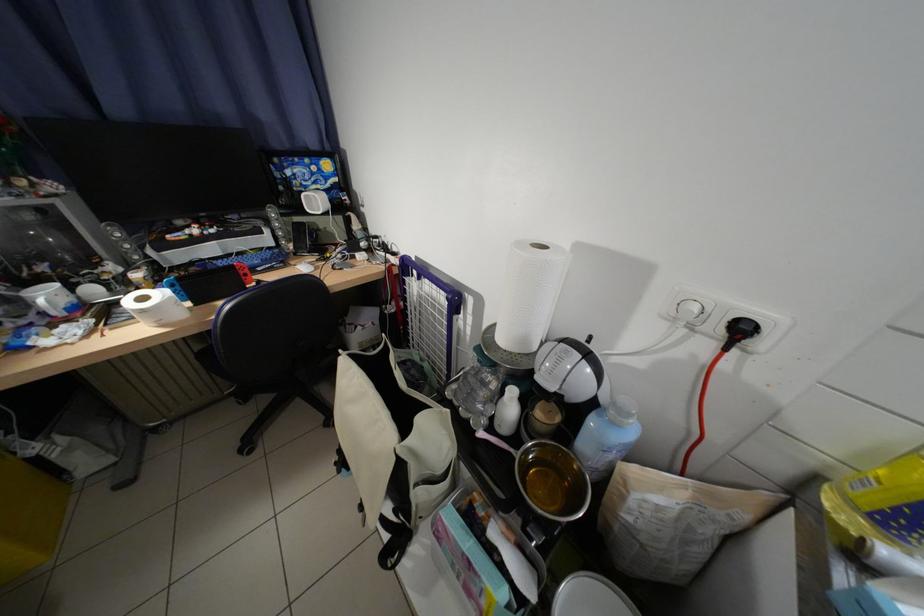
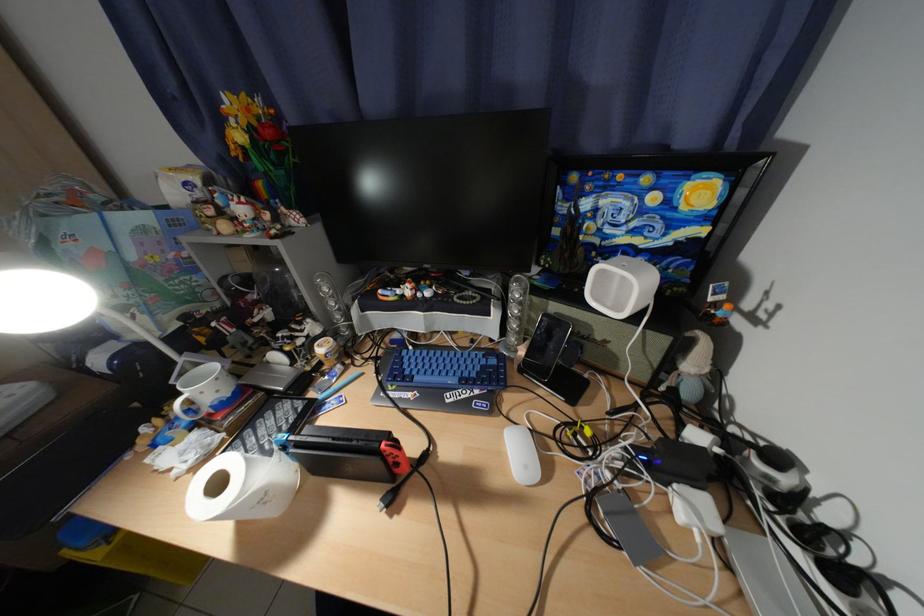
The point at (x=258, y=276) is marked in the first image. Where is the corresponding point in the second image?

(408, 466)